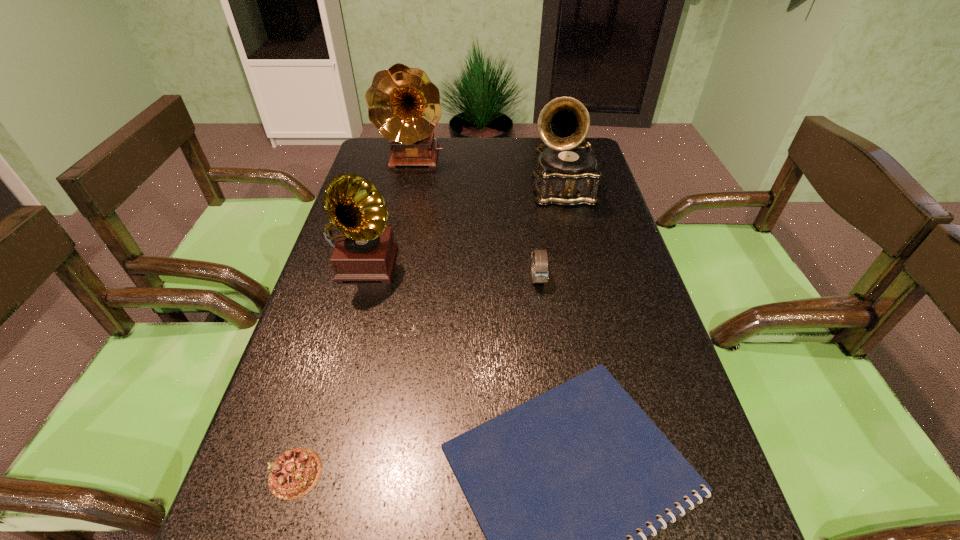
Where is `object that is at the right edge`? The width and height of the screenshot is (960, 540). object that is at the right edge is located at coordinates (567, 174).

Identify the location of object at the far left corner. This screenshot has width=960, height=540. (403, 104).

Where is `object that is at the far right corner`? The width and height of the screenshot is (960, 540). object that is at the far right corner is located at coordinates (567, 174).

The image size is (960, 540). In the image, there is a desktop. In order to click on free region at the far edge in this screenshot , I will do `click(493, 139)`.

The width and height of the screenshot is (960, 540). In the image, there is a desktop. In order to click on vacant space at the left edge in this screenshot , I will do `click(332, 528)`.

Where is `free space at the right edge of the desktop`? This screenshot has width=960, height=540. free space at the right edge of the desktop is located at coordinates (617, 315).

Find the location of `blank region between the rightmost phonograph record and the fourth shortest object`. blank region between the rightmost phonograph record and the fourth shortest object is located at coordinates (464, 227).

Image resolution: width=960 pixels, height=540 pixels. Identify the location of free spot between the rightmost phonograph record and the nearest phonograph record. (464, 227).

In order to click on free space between the shortest phonograph record and the fourth tallest object in this screenshot , I will do `click(452, 271)`.

Identify the location of vacant area that lies between the fifth tallest object and the fourth shortest object. (330, 368).